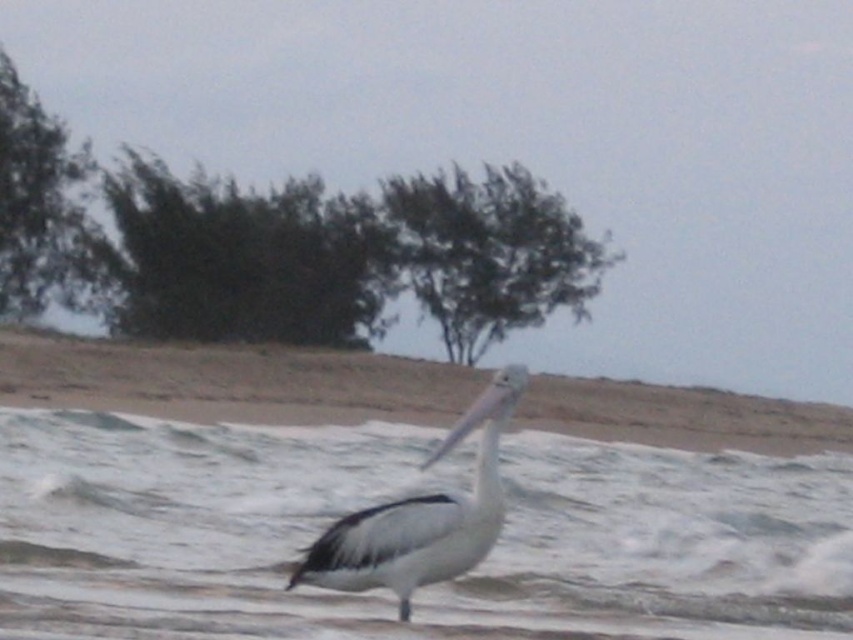
Consider the image. Does beige sandy beach at lower center have a larger size compared to green leafy tree at upper left?

Indeed, beige sandy beach at lower center has a larger size compared to green leafy tree at upper left.

Who is more forward, [306,387] or [0,198]?

Point [306,387] is in front.

Where is `beige sandy beach at lower center`? This screenshot has height=640, width=853. beige sandy beach at lower center is located at coordinates (230, 381).

Can you confirm if beige sandy beach at lower center is bigger than green leafy tree at center?

Correct, beige sandy beach at lower center is larger in size than green leafy tree at center.

The image size is (853, 640). What do you see at coordinates (230, 381) in the screenshot?
I see `beige sandy beach at lower center` at bounding box center [230, 381].

Find the location of `beige sandy beach at lower center`. beige sandy beach at lower center is located at coordinates (230, 381).

Who is more distant from viewer, (235, 611) or (497, 474)?

Point (235, 611)

Is white smooth water at center to the right of white matte pelican at center from the viewer's perspective?

Correct, you'll find white smooth water at center to the right of white matte pelican at center.

Who is more forward, (651, 524) or (393, 540)?

Point (393, 540) is in front.

Identify the location of white smooth water at center. Image resolution: width=853 pixels, height=640 pixels. (397, 497).